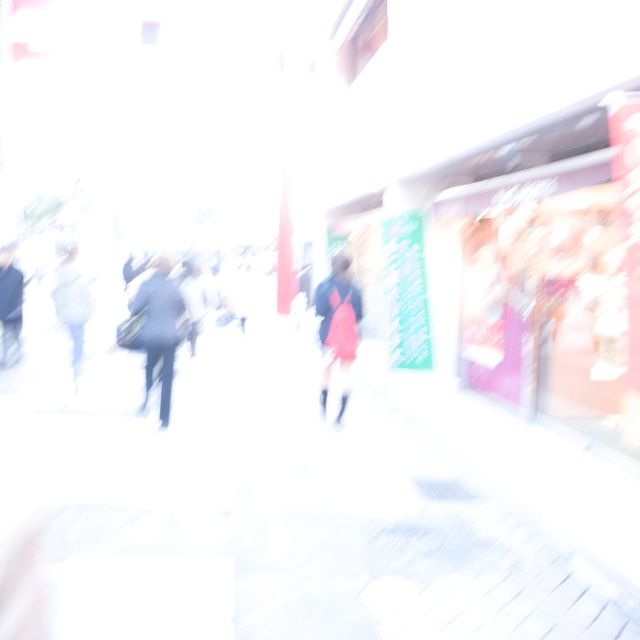
Between white concrete pavement at center and dark blue suit at center, which one has more height?

dark blue suit at center is taller.

Can you confirm if white concrete pavement at center is smaller than dark blue suit at center?

No, white concrete pavement at center is not smaller than dark blue suit at center.

The width and height of the screenshot is (640, 640). In order to click on white concrete pavement at center in this screenshot , I will do `click(296, 516)`.

Find the location of `white concrete pavement at center`. white concrete pavement at center is located at coordinates coord(296,516).

Can you confirm if dark blue suit at center is positioned above red fabric coat at center?

No, dark blue suit at center is not above red fabric coat at center.

Is dark blue suit at center bigger than red fabric coat at center?

Yes.

Does point (152, 300) come closer to viewer compared to point (317, 310)?

Yes, it is.

Locate an element on the screen. dark blue suit at center is located at coordinates (157, 330).

Which is below, white concrete pavement at center or red fabric coat at center?

white concrete pavement at center is lower down.

This screenshot has height=640, width=640. Find the location of `white concrete pavement at center`. white concrete pavement at center is located at coordinates (296, 516).